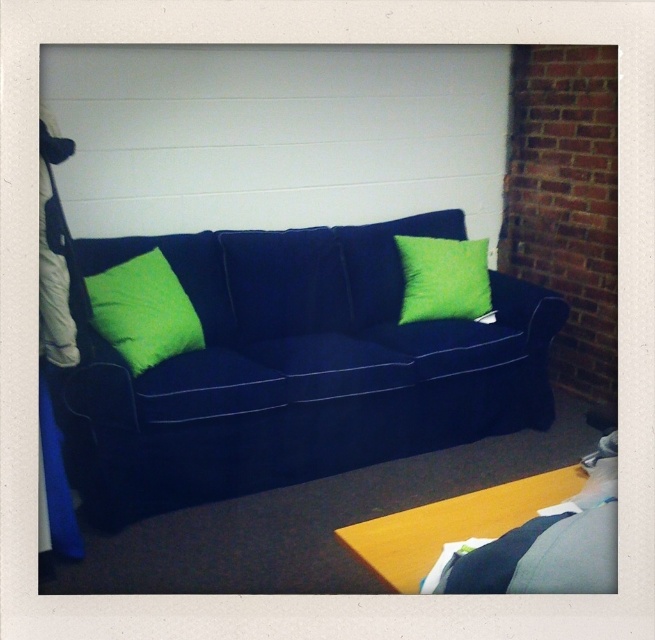
Is velvet dark blue couch at center to the right of lime green fabric pillow at left from the viewer's perspective?

Correct, you'll find velvet dark blue couch at center to the right of lime green fabric pillow at left.

Between point (329, 230) and point (153, 264), which one is positioned in front?

Point (153, 264) is more forward.

Between point (468, 387) and point (113, 321), which one is positioned in front?

Point (113, 321) is more forward.

In order to click on velvet dark blue couch at center in this screenshot , I will do `click(297, 369)`.

Is lime green fabric pillow at left taller than lime green fabric pillow at center?

Correct, lime green fabric pillow at left is much taller as lime green fabric pillow at center.

Which is more to the right, lime green fabric pillow at left or lime green fabric pillow at center?

lime green fabric pillow at center is more to the right.

Consider the image. Who is more distant from viewer, (136, 266) or (476, 257)?

The point (476, 257) is more distant.

Image resolution: width=655 pixels, height=640 pixels. Identify the location of lime green fabric pillow at left. (143, 310).

Between point (131, 474) and point (455, 248), which one is positioned behind?

The point (455, 248) is behind.

Is velvet dark blue couch at center taller than lime green fabric pillow at center?

Yes, velvet dark blue couch at center is taller than lime green fabric pillow at center.

What are the coordinates of `velvet dark blue couch at center` in the screenshot? It's located at (297, 369).

Find the location of a particular element. velvet dark blue couch at center is located at coordinates (297, 369).